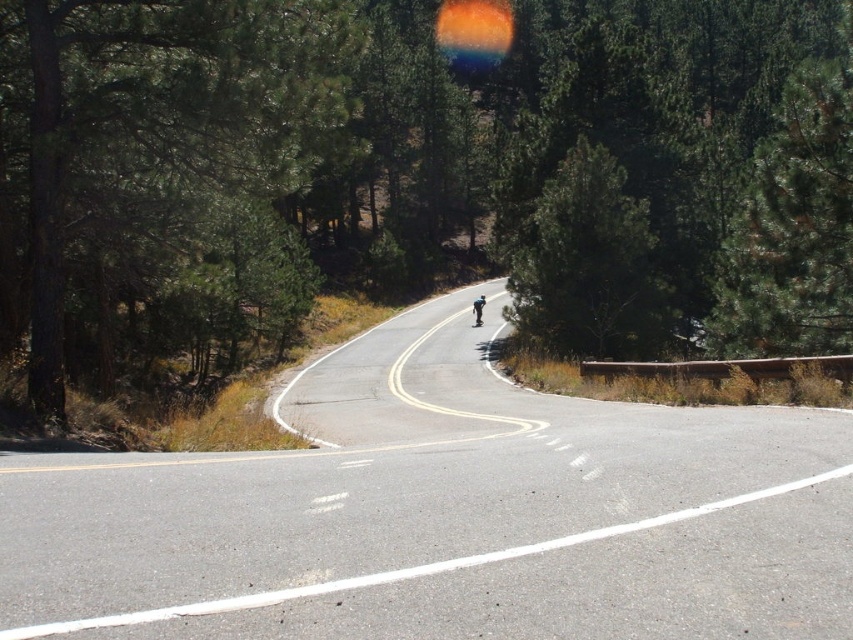
You are a cyclist approaching a curve in the road. You see the asphalt road at left and the blue glossy skateboard at center. Which object is closer to the left side of the road?

The asphalt road at left is to the left of the blue glossy skateboard at center, so the asphalt road at left is closer to the left side of the road.

You are a hiker standing at the edge of the asphalt road at left. You want to take a photo of the green leafy tree at center. Which direction should you face to capture the tree in your viewfinder?

The green leafy tree at center is taller than the asphalt road at left, so you should face towards the center of the road to capture the tree in your viewfinder since it is positioned higher than the road.